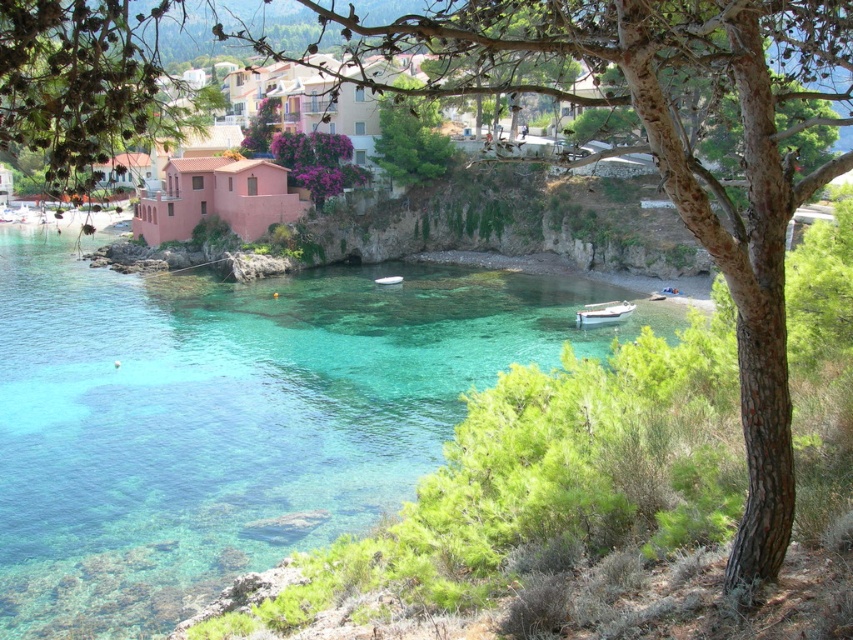
Question: Is clear glass water at center below white matte boat at lower center?

Choices:
 (A) yes
 (B) no

Answer: (A)

Question: Does green leafy tree at center appear under white matte boat at lower center?

Choices:
 (A) yes
 (B) no

Answer: (B)

Question: Which is farther from the green leafy tree at center?

Choices:
 (A) white matte boat at lower center
 (B) clear glass water at center

Answer: (A)

Question: Can you confirm if clear glass water at center is positioned to the right of green leafy tree at center?

Choices:
 (A) no
 (B) yes

Answer: (A)

Question: Which point appears farthest from the camera in this image?

Choices:
 (A) (601, 310)
 (B) (402, 131)

Answer: (B)

Question: Which object is closer to the camera taking this photo?

Choices:
 (A) green leafy tree at center
 (B) white matte boat at lower center
 (C) clear glass water at center

Answer: (A)